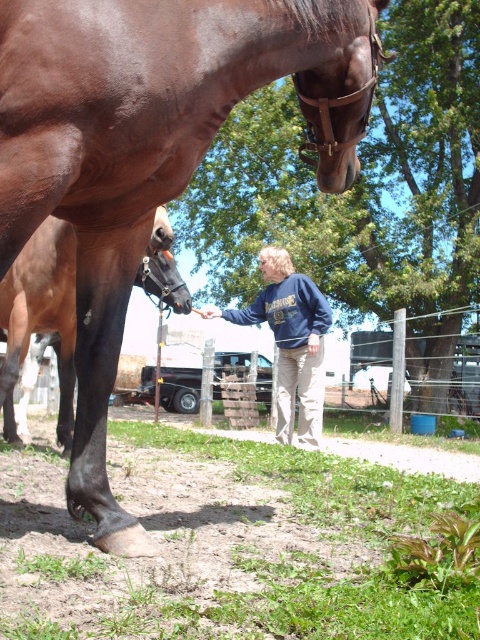
Between black glossy horse leg at lower left and blue sweatshirt at center, which one is positioned higher?

black glossy horse leg at lower left is above.

This screenshot has height=640, width=480. What do you see at coordinates (40, 317) in the screenshot?
I see `black glossy horse leg at lower left` at bounding box center [40, 317].

At what (x,y) coordinates should I click in order to perform the action: click on black glossy horse leg at lower left. Please return your answer as a coordinate pair (x, y). Looking at the image, I should click on (40, 317).

Which is behind, point (344, 61) or point (303, 337)?

The point (303, 337) is more distant.

Measure the distance between shiny brown horse at center and blue sweatshirt at center.

shiny brown horse at center is 3.02 meters from blue sweatshirt at center.

What do you see at coordinates (149, 148) in the screenshot? This screenshot has height=640, width=480. I see `shiny brown horse at center` at bounding box center [149, 148].

Where is `shiny brown horse at center`? This screenshot has height=640, width=480. shiny brown horse at center is located at coordinates (149, 148).

Between point (115, 115) and point (47, 248), which one is positioned behind?

Point (47, 248)

Between shiny brown horse at center and black glossy horse leg at lower left, which one is positioned lower?

black glossy horse leg at lower left

Is point (308, 33) positioned behind point (25, 276)?

No, (308, 33) is in front of (25, 276).

Identify the location of shiny brown horse at center. (149, 148).